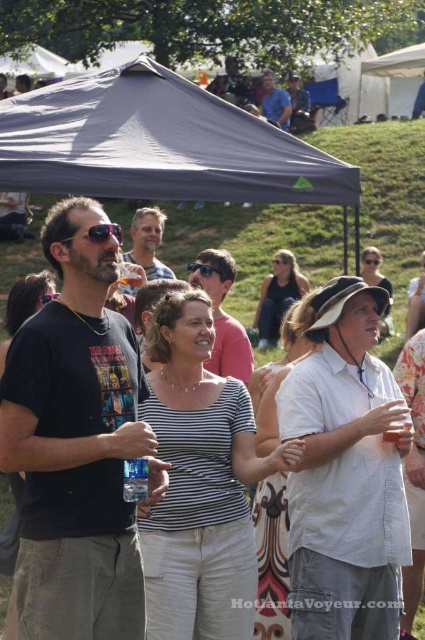
Question: From the image, what is the correct spatial relationship of white cotton shirt at center in relation to white canvas tent at upper center?

Choices:
 (A) above
 (B) below

Answer: (B)

Question: Considering the real-world distances, which object is farthest from the black plastic sunglasses at center?

Choices:
 (A) matte black sunglasses at center
 (B) white cotton shirt at center

Answer: (A)

Question: Is dark gray fabric canopy at upper center further to camera compared to black plastic sunglasses at center?

Choices:
 (A) yes
 (B) no

Answer: (B)

Question: Is white cotton shirt at center to the left of white canvas tent at upper center from the viewer's perspective?

Choices:
 (A) yes
 (B) no

Answer: (A)

Question: Which point is farther to the camera?

Choices:
 (A) white cotton shirt at center
 (B) matte black sunglasses at center
 (C) black plastic sunglasses at center
 (D) white canvas tent at upper center

Answer: (D)

Question: Based on their relative distances, which object is nearer to the dark gray fabric canopy at upper center?

Choices:
 (A) white canvas tent at upper center
 (B) white cotton shirt at center
 (C) matte black sunglasses at center

Answer: (C)